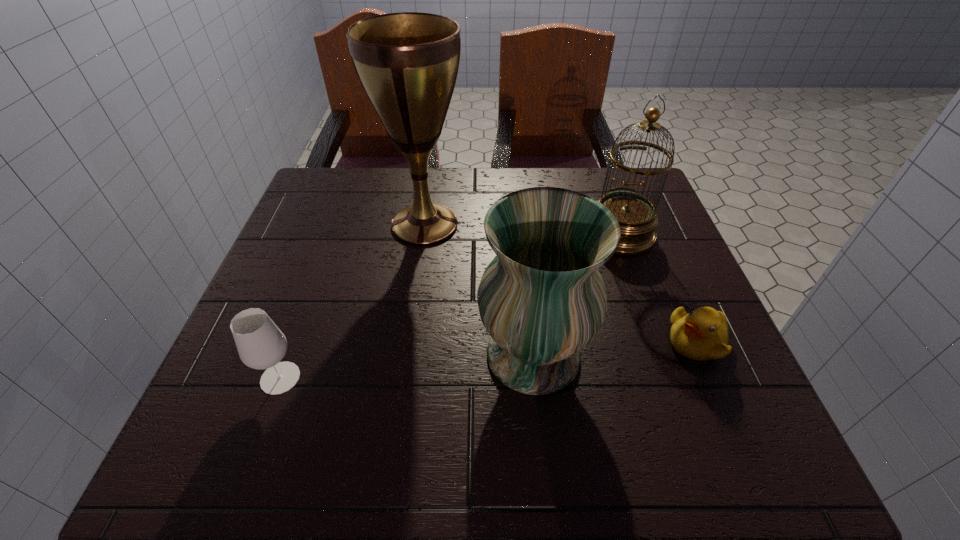
Identify the location of free space located 0.060m on the front of the leftmost object. The width and height of the screenshot is (960, 540). (261, 430).

This screenshot has width=960, height=540. What are the coordinates of `vacant point located on the front-facing side of the duckling` in the screenshot? It's located at (620, 341).

What are the coordinates of `blank space located on the front-facing side of the duckling` in the screenshot? It's located at (625, 341).

Where is `vacant space located on the front-facing side of the duckling`? vacant space located on the front-facing side of the duckling is located at coordinates (529, 341).

Locate an element on the screen. The height and width of the screenshot is (540, 960). trophy cup that is at the far edge is located at coordinates (407, 63).

Where is `birdcage located in the far edge section of the desktop`? The height and width of the screenshot is (540, 960). birdcage located in the far edge section of the desktop is located at coordinates (637, 216).

Locate an element on the screen. Image resolution: width=960 pixels, height=540 pixels. object located at the left edge is located at coordinates (261, 345).

In order to click on birdcage positioned at the right edge in this screenshot , I will do tap(637, 216).

The image size is (960, 540). I want to click on duckling that is at the right edge, so click(x=701, y=335).

Identify the location of object positioned at the far right corner. The image size is (960, 540). (637, 216).